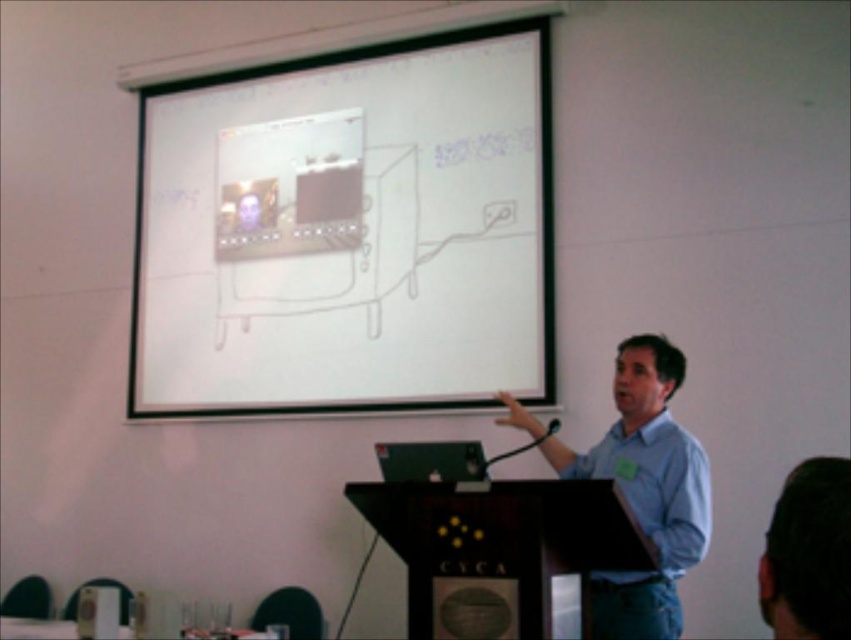
Question: Among these objects, which one is nearest to the camera?

Choices:
 (A) matte blue shirt at center
 (B) white matte projection screen at upper center
 (C) black wood podium at center

Answer: (C)

Question: Does white matte projection screen at upper center appear over black wood podium at center?

Choices:
 (A) yes
 (B) no

Answer: (A)

Question: Which point is farther to the camera?

Choices:
 (A) white matte projection screen at upper center
 (B) matte blue shirt at center

Answer: (A)

Question: Can you confirm if white matte projection screen at upper center is wider than matte blue shirt at center?

Choices:
 (A) yes
 (B) no

Answer: (A)

Question: Based on their relative distances, which object is nearer to the blue shirt at center?

Choices:
 (A) white matte projection screen at upper center
 (B) dark brown hair at upper right
 (C) matte blue shirt at center

Answer: (C)

Question: Is white matte projection screen at upper center thinner than dark brown hair at upper right?

Choices:
 (A) no
 (B) yes

Answer: (A)